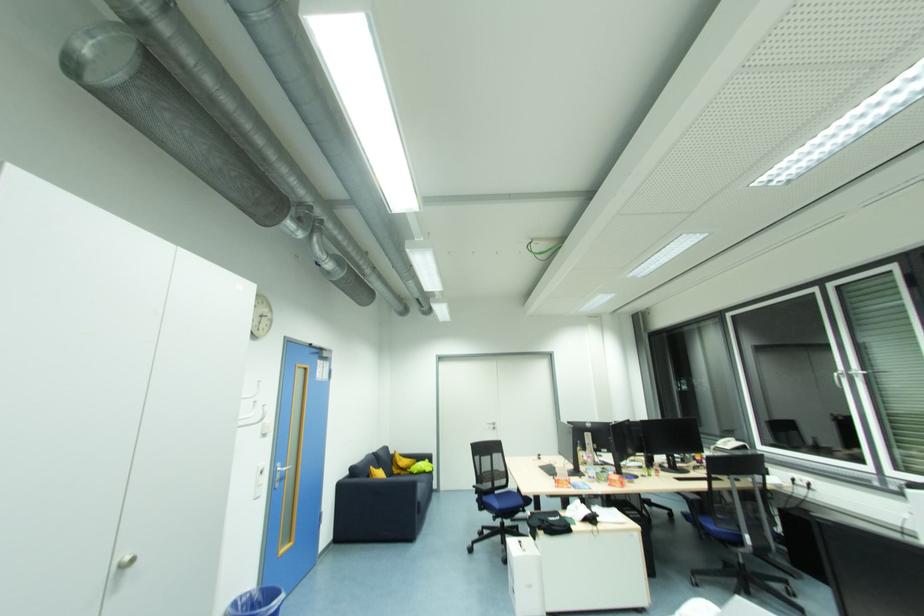
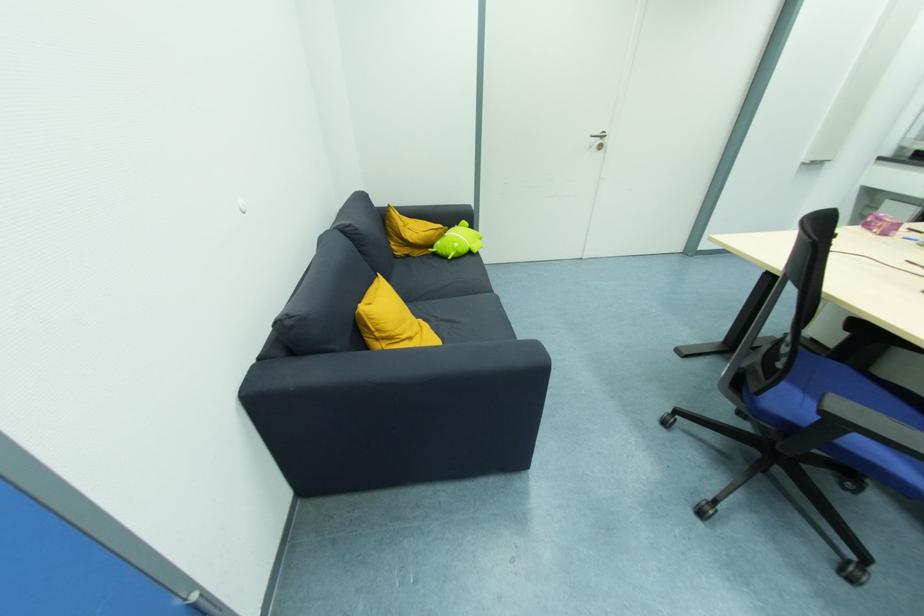
Locate, in the second image, the point that corresponds to point (398, 472) in the first image.

(403, 253)